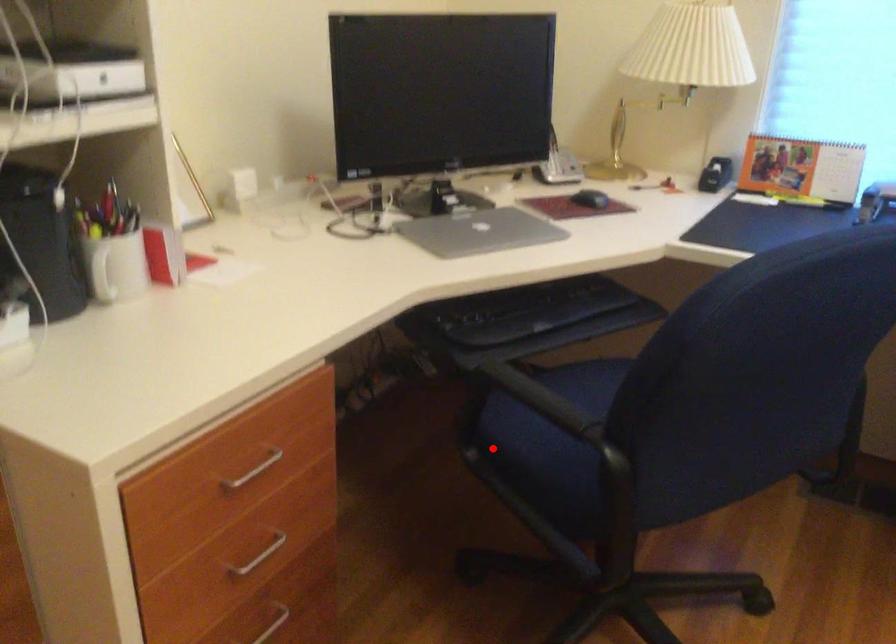
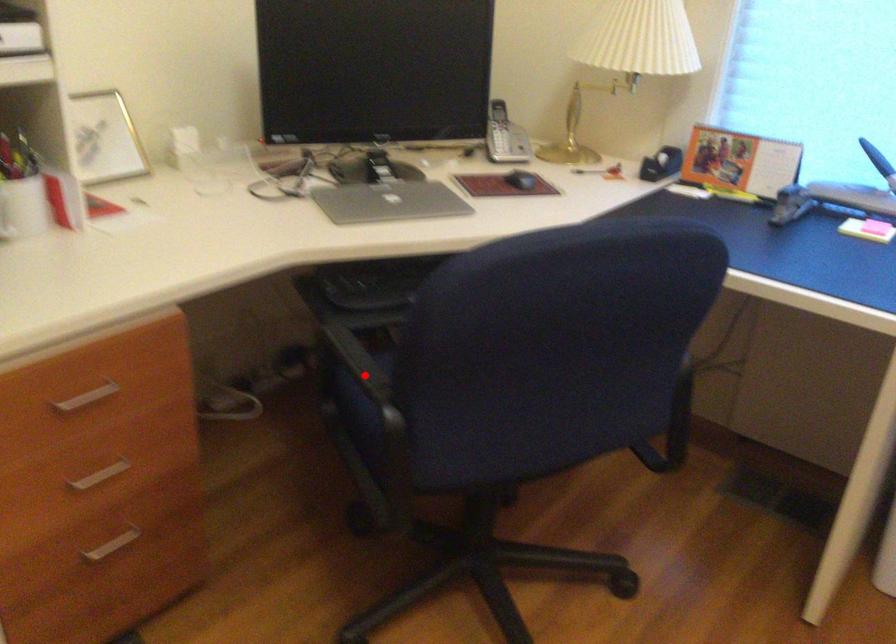
I am providing you with two images of the same scene from different viewpoints. A red point is marked on the first image and another point is marked on the second image. Is the marked point in image1 the same physical position as the marked point in image2?

No